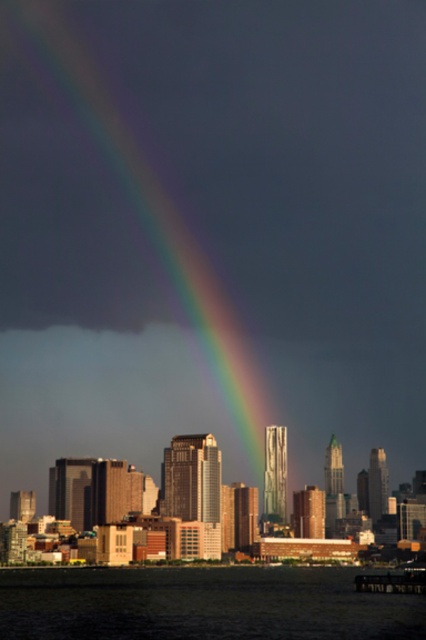
You are standing in the city looking at the stormy sky with the rainbow. You see the transparent water at lower center and the smooth glass skyscraper at center. Which object is located to the right of the other?

The transparent water at lower center is to the right of the smooth glass skyscraper at center.

You are a photographer aiming to capture the rainbow at center and the smooth glass skyscraper at center in a single frame. Based on the scene, which object appears wider in the image?

The rainbow at center appears wider than the smooth glass skyscraper at center because the rainbow at center has a greater width compared to the skyscraper.

You are a photographer standing in the city park. You want to capture the smooth glass skyscraper at center through the transparent water at lower center. Will the skyscraper be visible in the reflection of the water?

The smooth glass skyscraper at center is behind transparent water at lower center, so the skyscraper will be visible in the reflection of the transparent water at lower center.